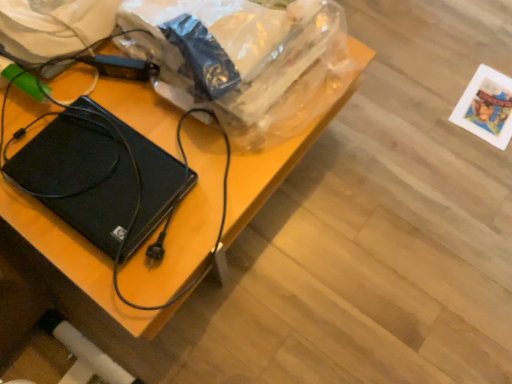
Image resolution: width=512 pixels, height=384 pixels. I want to click on unoccupied area behind black matte laptop at left, so click(115, 92).